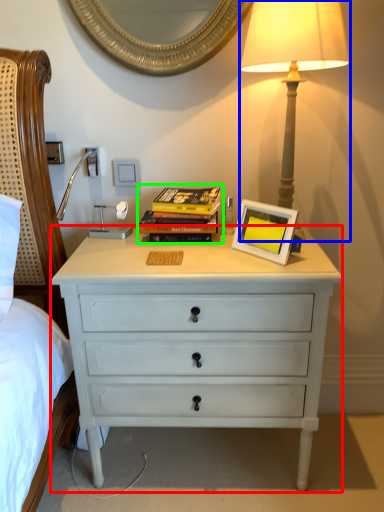
Question: Based on their relative distances, which object is farther from chest of drawers (highlighted by a red box)? Choose from bedside lamp (highlighted by a blue box) and magazine (highlighted by a green box).

Choices:
 (A) bedside lamp
 (B) magazine

Answer: (A)